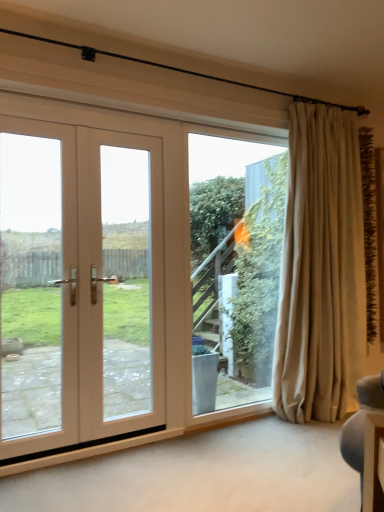
Question: From the image's perspective, is transparent glass window at center located above or below white wood door at left?

Choices:
 (A) below
 (B) above

Answer: (A)

Question: Is transparent glass window at center to the left or to the right of white wood door at left in the image?

Choices:
 (A) right
 (B) left

Answer: (A)

Question: Estimate the real-world distances between objects in this image. Which object is closer to the transparent glass window at center?

Choices:
 (A) white wood door at left
 (B) beige fabric curtain at right

Answer: (B)

Question: Considering the real-world distances, which object is farthest from the beige fabric curtain at right?

Choices:
 (A) transparent glass window at center
 (B) white wood door at left

Answer: (B)